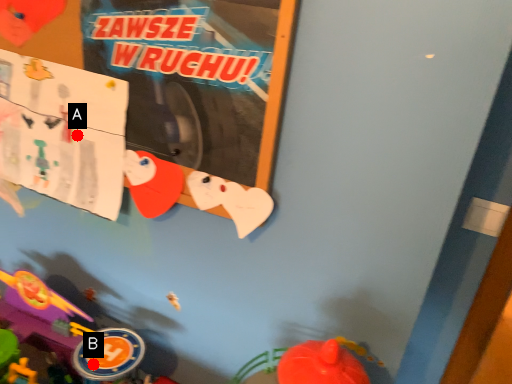
Question: Two points are circled on the image, labeled by A and B beside each circle. Among these points, which one is nearest to the camera?

Choices:
 (A) A is closer
 (B) B is closer

Answer: (B)